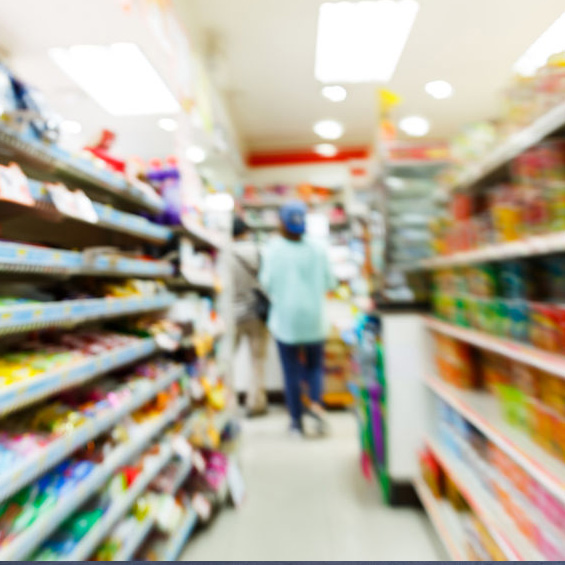
The width and height of the screenshot is (565, 565). I want to click on wall, so click(x=318, y=173).